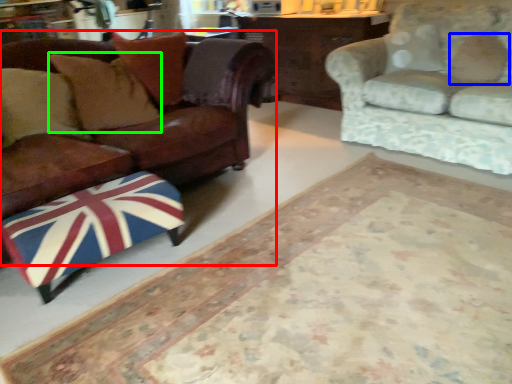
Question: Based on their relative distances, which object is farther from studio couch (highlighted by a red box)? Choose from pillow (highlighted by a blue box) and pillow (highlighted by a green box).

Choices:
 (A) pillow
 (B) pillow

Answer: (A)